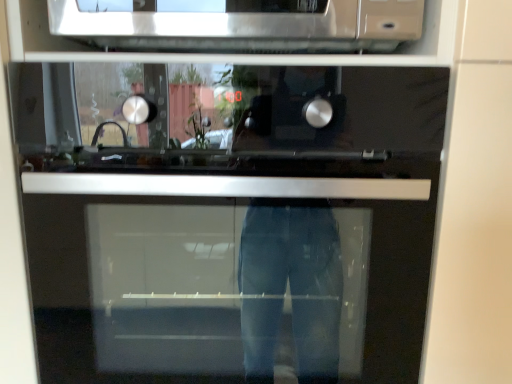
The height and width of the screenshot is (384, 512). What do you see at coordinates (229, 221) in the screenshot?
I see `stainless steel oven at center` at bounding box center [229, 221].

At what (x,y) coordinates should I click in order to perform the action: click on stainless steel oven at center. Please return your answer as a coordinate pair (x, y). Looking at the image, I should click on (229, 221).

You are a GUI agent. You are given a task and a screenshot of the screen. Output one action in this format:
    pyautogui.click(x=<x>, y=<y>)
    Task: Click on the stainless steel oven at center
    The width and height of the screenshot is (512, 384).
    Given the screenshot: What is the action you would take?
    pyautogui.click(x=229, y=221)